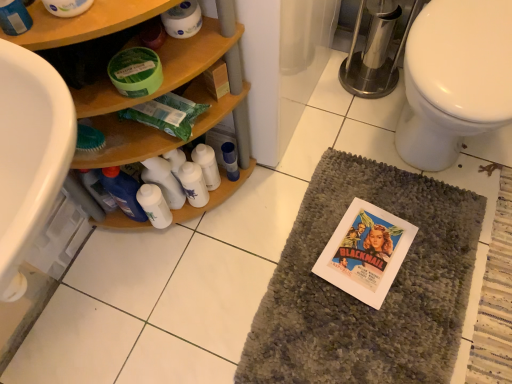
Image resolution: width=512 pixels, height=384 pixels. I want to click on free spot to the right of white paper comic book at center, so click(x=438, y=244).